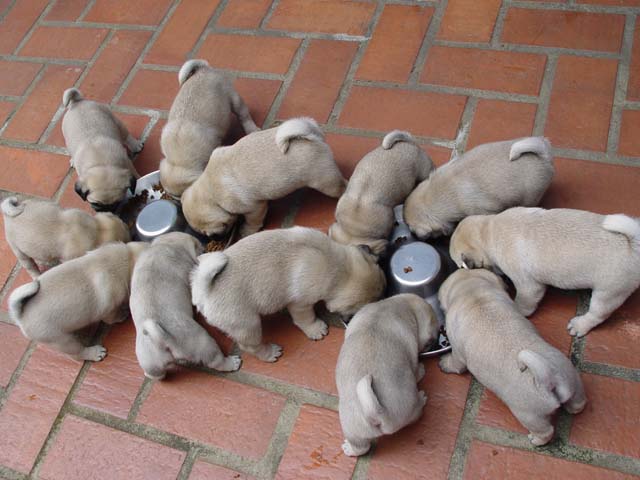
Where is `slight wet marks on the floor`? slight wet marks on the floor is located at coordinates (315, 461), (29, 399), (493, 451).